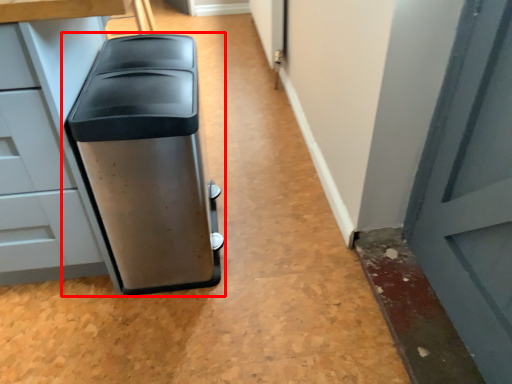
Question: From the image's perspective, what is the correct spatial positioning of waste container (annotated by the red box) in reference to cabinetry?

Choices:
 (A) below
 (B) above

Answer: (A)